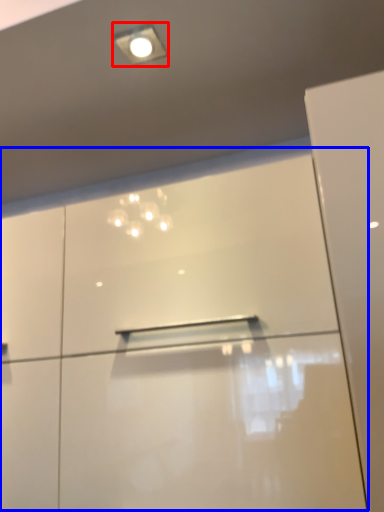
Question: Which point is closer to the camera, droplight (highlighted by a red box) or dresser (highlighted by a blue box)?

Choices:
 (A) droplight
 (B) dresser

Answer: (B)